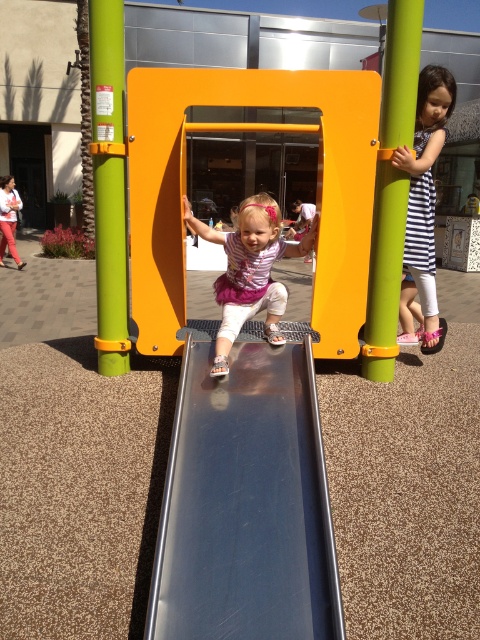
Question: Estimate the real-world distances between objects in this image. Which object is closer to the striped fabric dress at right?

Choices:
 (A) matte pink dress at center
 (B) metallic smooth slide at center

Answer: (A)

Question: Does matte pink dress at center have a larger size compared to striped fabric dress at right?

Choices:
 (A) yes
 (B) no

Answer: (B)

Question: Is matte pink dress at center to the left of striped fabric dress at right from the viewer's perspective?

Choices:
 (A) no
 (B) yes

Answer: (B)

Question: Considering the real-world distances, which object is farthest from the striped fabric dress at right?

Choices:
 (A) matte pink dress at center
 (B) metallic smooth slide at center

Answer: (B)

Question: Which point appears closest to the camera in this image?

Choices:
 (A) (291, 392)
 (B) (432, 225)

Answer: (A)

Question: Does metallic smooth slide at center appear on the right side of matte pink dress at center?

Choices:
 (A) no
 (B) yes

Answer: (B)